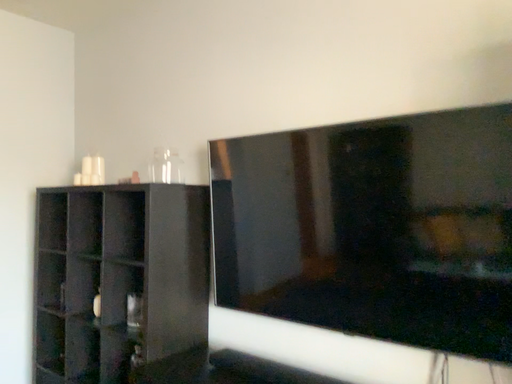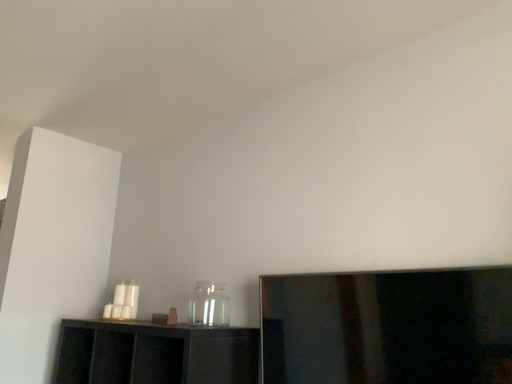
Question: How did the camera likely rotate when shooting the video?

Choices:
 (A) rotated upward
 (B) rotated downward

Answer: (A)